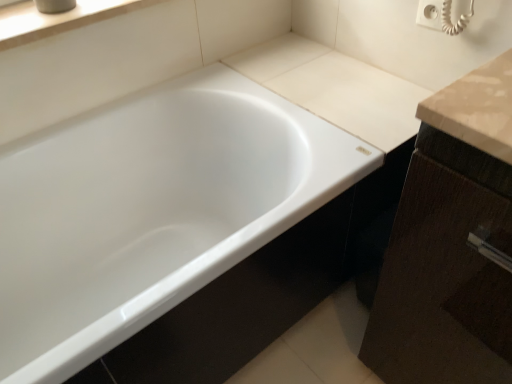
The image size is (512, 384). Describe the element at coordinates (58, 19) in the screenshot. I see `white smooth window sill at upper left` at that location.

Measure the distance between white smooth window sill at upper left and camera.

They are 38.41 inches apart.

At what (x,y) coordinates should I click in order to perform the action: click on white smooth window sill at upper left. Please return your answer as a coordinate pair (x, y). The height and width of the screenshot is (384, 512). Looking at the image, I should click on (58, 19).

Describe the element at coordinates (151, 211) in the screenshot. I see `white glossy bathtub at center` at that location.

Identify the location of white glossy bathtub at center. This screenshot has height=384, width=512. click(x=151, y=211).

Measure the distance between white glossy bathtub at center and camera.

white glossy bathtub at center is 61.70 centimeters from camera.

Identify the location of white smooth window sill at upper left. [x=58, y=19].

Which is more to the left, white smooth window sill at upper left or white glossy bathtub at center?

Positioned to the left is white smooth window sill at upper left.

Does white smooth window sill at upper left lie in front of white glossy bathtub at center?

No, white smooth window sill at upper left is behind white glossy bathtub at center.

Considering the points (36, 36) and (68, 317), which point is behind, point (36, 36) or point (68, 317)?

Point (68, 317)

From the image's perspective, who appears lower, white smooth window sill at upper left or white glossy bathtub at center?

white glossy bathtub at center appears lower in the image.

From a real-world perspective, is white smooth window sill at upper left physically located above or below white glossy bathtub at center?

From a real-world perspective, white smooth window sill at upper left is physically above white glossy bathtub at center.

Which object is thinner, white smooth window sill at upper left or white glossy bathtub at center?

Thinner between the two is white smooth window sill at upper left.

Is white smooth window sill at upper left taller or shorter than white glossy bathtub at center?

white smooth window sill at upper left is shorter than white glossy bathtub at center.

Can you confirm if white smooth window sill at upper left is smaller than white glossy bathtub at center?

Yes, white smooth window sill at upper left is smaller than white glossy bathtub at center.

Is white glossy bathtub at center inside white smooth window sill at upper left?

Actually, white glossy bathtub at center is outside white smooth window sill at upper left.

Is white smooth window sill at upper left far from white glossy bathtub at center?

Actually, white smooth window sill at upper left and white glossy bathtub at center are a little close together.

Consider the image. Is white smooth window sill at upper left facing towards white glossy bathtub at center?

No, white smooth window sill at upper left does not turn towards white glossy bathtub at center.

Locate an element on the screen. bathtub beneath the white smooth window sill at upper left (from a real-world perspective) is located at coordinates (151, 211).

Considering the positions of objects white glossy bathtub at center and white smooth window sill at upper left in the image provided, who is more to the right, white glossy bathtub at center or white smooth window sill at upper left?

white glossy bathtub at center.

Is the position of white glossy bathtub at center less distant than that of white smooth window sill at upper left?

Yes, white glossy bathtub at center is in front of white smooth window sill at upper left.

Does point (241, 218) come in front of point (79, 21)?

No, (241, 218) is further to viewer.

From the image's perspective, is white glossy bathtub at center located beneath white smooth window sill at upper left?

Indeed, from the image's perspective, white glossy bathtub at center is shown beneath white smooth window sill at upper left.

From a real-world perspective, is white glossy bathtub at center below white smooth window sill at upper left?

Yes, from a real-world perspective, white glossy bathtub at center is below white smooth window sill at upper left.

Which of these two, white glossy bathtub at center or white smooth window sill at upper left, is wider?

white glossy bathtub at center is wider.

Considering the relative sizes of white glossy bathtub at center and white smooth window sill at upper left in the image provided, is white glossy bathtub at center taller than white smooth window sill at upper left?

Indeed, white glossy bathtub at center has a greater height compared to white smooth window sill at upper left.

Who is bigger, white glossy bathtub at center or white smooth window sill at upper left?

Bigger between the two is white glossy bathtub at center.

Is white glossy bathtub at center inside the boundaries of white smooth window sill at upper left, or outside?

white glossy bathtub at center lies outside white smooth window sill at upper left.

Is white glossy bathtub at center placed right next to white smooth window sill at upper left?

No, white glossy bathtub at center is not with white smooth window sill at upper left.

Is white glossy bathtub at center oriented towards white smooth window sill at upper left?

No, white glossy bathtub at center is not aimed at white smooth window sill at upper left.

How many degrees apart are the facing directions of white glossy bathtub at center and white smooth window sill at upper left?

The angular difference between white glossy bathtub at center and white smooth window sill at upper left is 0.0775 degrees.

Measure the distance between white glossy bathtub at center and white smooth window sill at upper left.

white glossy bathtub at center and white smooth window sill at upper left are 48.97 centimeters apart from each other.

Identify the location of bathtub in front of the white smooth window sill at upper left. (151, 211).

The image size is (512, 384). In order to click on window sill positioned vertically above the white glossy bathtub at center (from a real-world perspective) in this screenshot , I will do `click(58, 19)`.

The height and width of the screenshot is (384, 512). In order to click on bathtub on the right of white smooth window sill at upper left in this screenshot , I will do `click(151, 211)`.